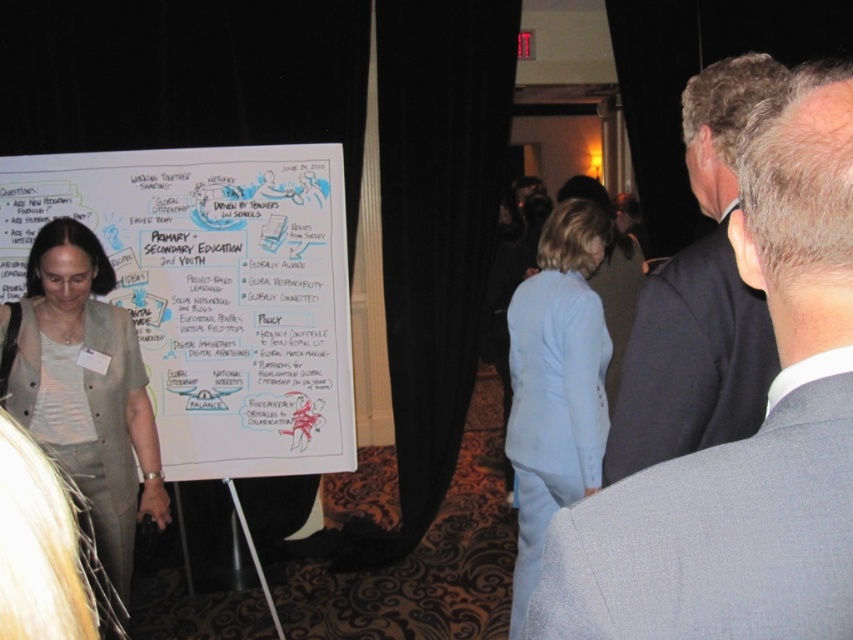
Does dark suit at center have a lesser width compared to light beige fabric jacket at left?

Correct, dark suit at center's width is less than light beige fabric jacket at left's.

Who is higher up, dark suit at center or light beige fabric jacket at left?

dark suit at center is above.

Which is behind, point (709, 200) or point (1, 392)?

Positioned behind is point (1, 392).

This screenshot has height=640, width=853. Find the location of `dark suit at center`. dark suit at center is located at coordinates (699, 300).

Is point (679, 396) behind point (515, 468)?

No, it is not.

Is dark suit at center bigger than light blue fabric suit at center?

Incorrect, dark suit at center is not larger than light blue fabric suit at center.

Does point (747, 378) come behind point (592, 369)?

No, it is in front of (592, 369).

Where is `dark suit at center`? dark suit at center is located at coordinates (699, 300).

Who is taller, whiteboard at center or light blue fabric suit at center?

light blue fabric suit at center is taller.

Does whiteboard at center have a smaller size compared to light blue fabric suit at center?

Indeed, whiteboard at center has a smaller size compared to light blue fabric suit at center.

Is point (352, 460) more distant than point (519, 586)?

Yes.

Locate an element on the screen. The image size is (853, 640). whiteboard at center is located at coordinates (215, 292).